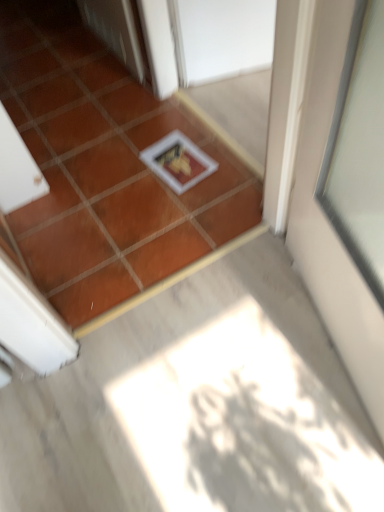
At what (x,y) coordinates should I click in order to perform the action: click on vacant area on top of white glossy frame at center (from a real-world perspective). Please return your answer as a coordinate pair (x, y). The height and width of the screenshot is (512, 384). Looking at the image, I should click on (153, 339).